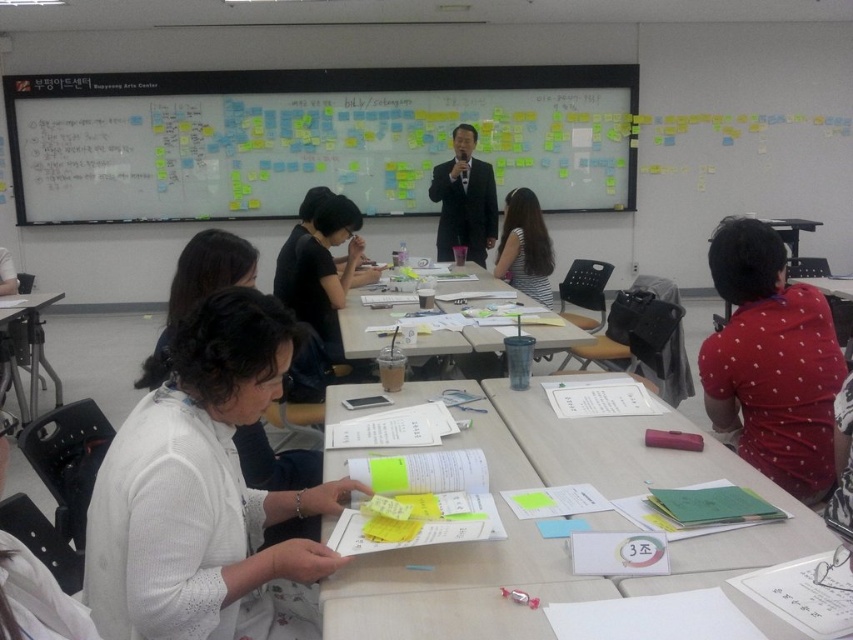
Can you confirm if red dotted shirt at right is positioned above metallic silver table at left?

Correct, red dotted shirt at right is located above metallic silver table at left.

Identify the location of red dotted shirt at right. This screenshot has width=853, height=640. (770, 362).

Looking at this image, is white textured sweater at center above striped fabric shirt at center?

Actually, white textured sweater at center is below striped fabric shirt at center.

I want to click on white textured sweater at center, so click(201, 490).

Who is more forward, [172,625] or [514,227]?

Point [172,625] is in front.

Locate an element on the screen. The image size is (853, 640). white textured sweater at center is located at coordinates (201, 490).

Does point (595, 67) come farther from viewer compared to point (21, 300)?

That is True.

Does white matte bulletin board at upper center appear on the right side of metallic silver table at left?

Correct, you'll find white matte bulletin board at upper center to the right of metallic silver table at left.

Describe the element at coordinates (311, 138) in the screenshot. I see `white matte bulletin board at upper center` at that location.

Image resolution: width=853 pixels, height=640 pixels. Find the location of `white matte bulletin board at upper center`. white matte bulletin board at upper center is located at coordinates (311, 138).